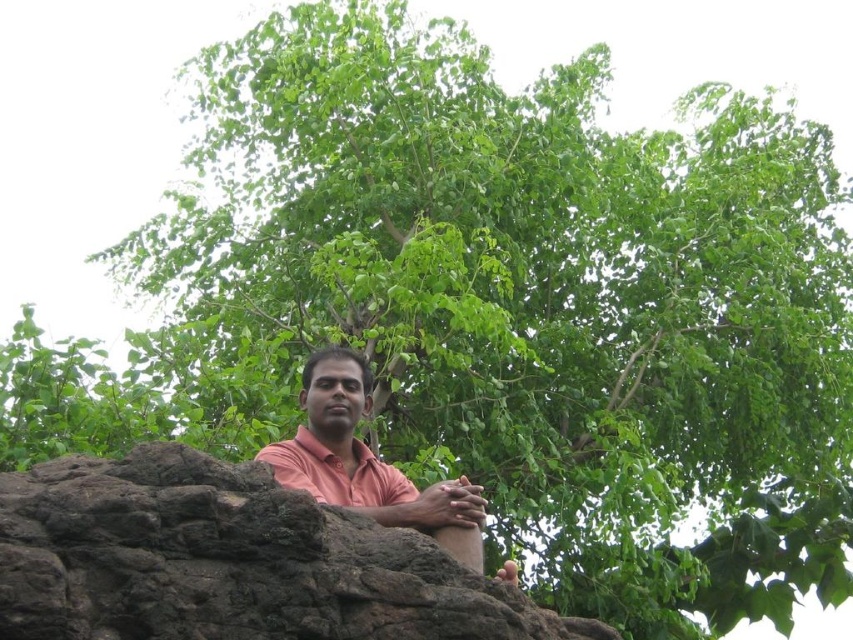
Does brown rough rock at center have a lesser width compared to pink matte shirt at center?

In fact, brown rough rock at center might be wider than pink matte shirt at center.

Does point (198, 493) come behind point (514, 580)?

No.

Identify the location of brown rough rock at center. This screenshot has height=640, width=853. (229, 561).